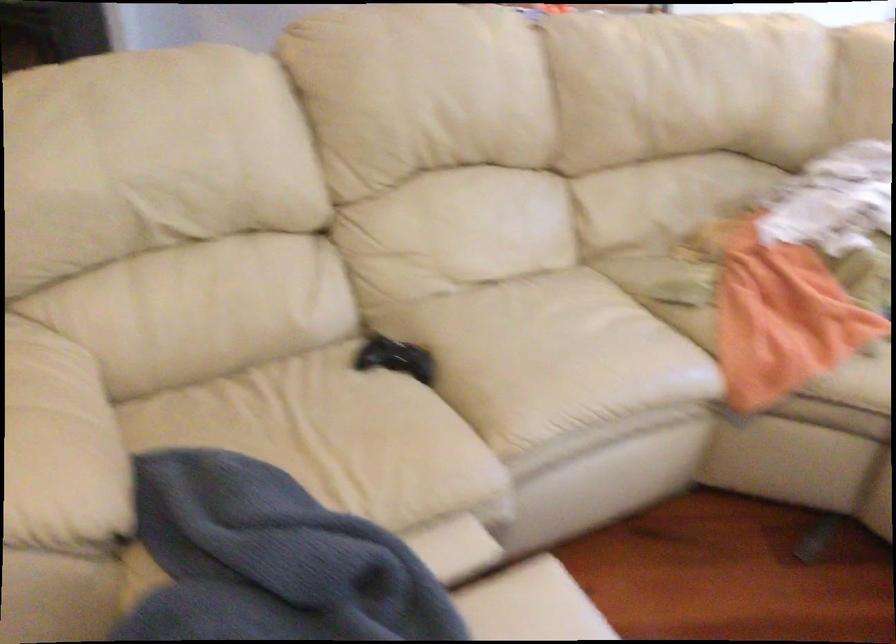
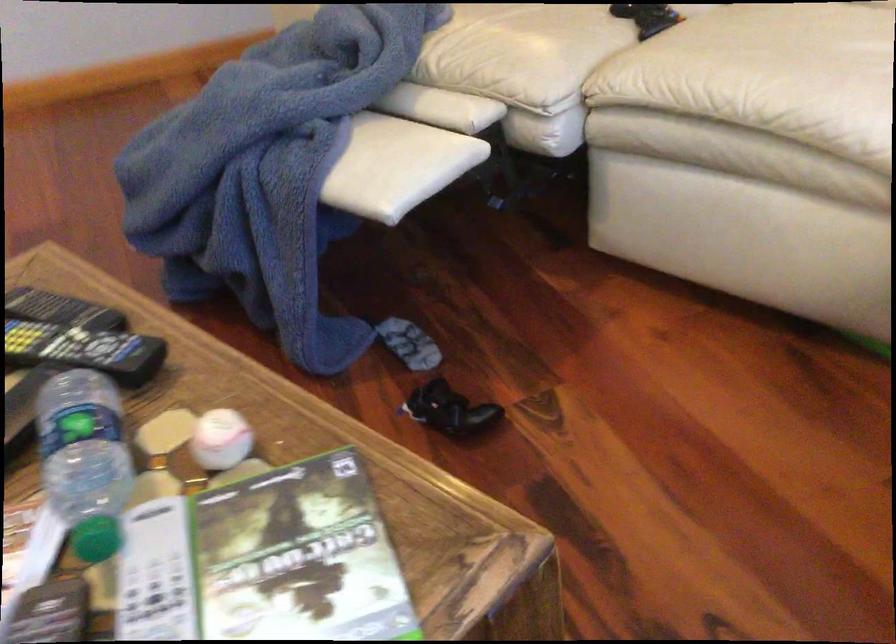
Locate, in the second image, the point that corresponds to [438,449] in the first image.

(524, 51)